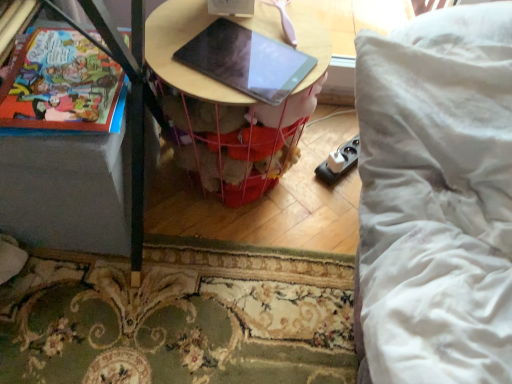
Question: Is wooden table at center to the left or to the right of matte paper comic book at left in the image?

Choices:
 (A) left
 (B) right

Answer: (B)

Question: Based on their sizes in the image, would you say wooden table at center is bigger or smaller than matte paper comic book at left?

Choices:
 (A) big
 (B) small

Answer: (A)

Question: Which object is the closest to the matte paper comic book at left?

Choices:
 (A) matte black tablet at center
 (B) wooden table at center

Answer: (A)

Question: Estimate the real-world distances between objects in this image. Which object is closer to the wooden table at center?

Choices:
 (A) matte paper comic book at left
 (B) matte black tablet at center

Answer: (B)